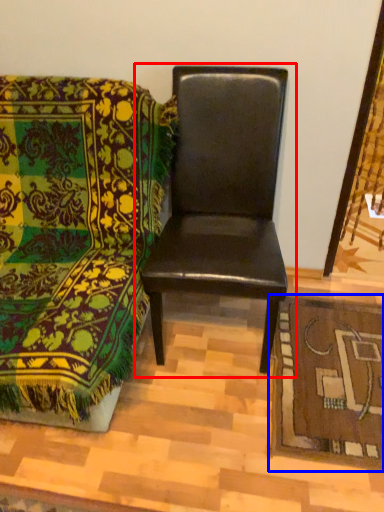
Question: Among these objects, which one is farthest to the camera, chair (highlighted by a red box) or mat (highlighted by a blue box)?

Choices:
 (A) chair
 (B) mat

Answer: (B)